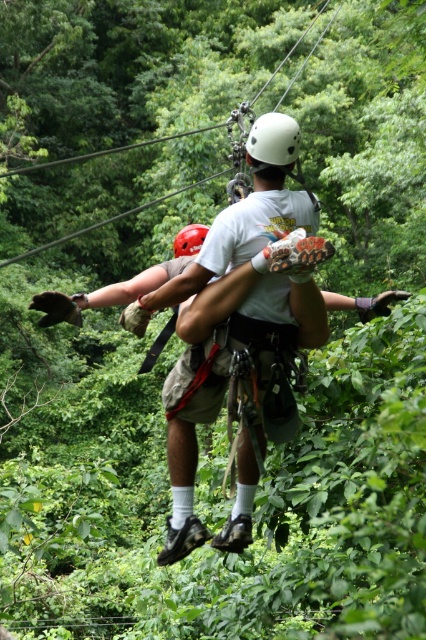
Is matte white helmet at center further to camera compared to white matte helmet at center?

No, it is in front of white matte helmet at center.

Who is taller, matte white helmet at center or white matte helmet at center?

matte white helmet at center

At what (x,y) coordinates should I click in order to perform the action: click on matte white helmet at center. Please return your answer as a coordinate pair (x, y). Looking at the image, I should click on (238, 348).